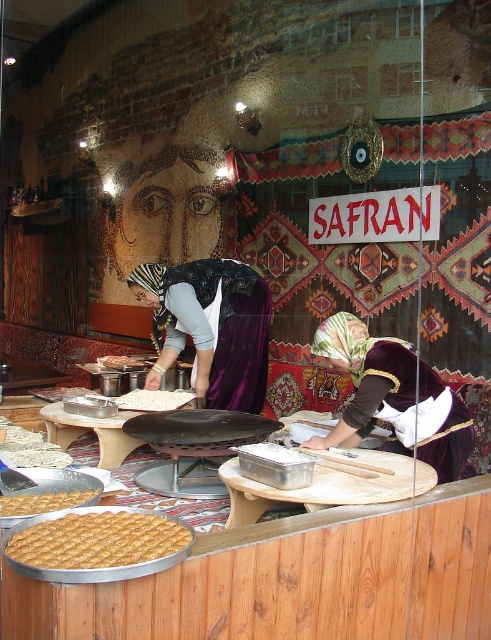
Is the position of velvet fabric headscarf at center more distant than that of white matte rice at center?

No, it is in front of white matte rice at center.

Is point (223, 291) closer to camera compared to point (129, 406)?

No.

This screenshot has height=640, width=491. I want to click on velvet fabric headscarf at center, so click(211, 326).

Can you confirm if velvet fabric headscarf at center is shorter than white flour at center?

No, velvet fabric headscarf at center is not shorter than white flour at center.

Who is taller, velvet fabric headscarf at center or white flour at center?

Standing taller between the two is velvet fabric headscarf at center.

Describe the element at coordinates (211, 326) in the screenshot. I see `velvet fabric headscarf at center` at that location.

At what (x,y) coordinates should I click in order to perform the action: click on velvet fabric headscarf at center. Please return your answer as a coordinate pair (x, y). This screenshot has width=491, height=640. Looking at the image, I should click on (211, 326).

Who is higher up, golden crispy pastry at center or golden crispy pastry at lower left?

golden crispy pastry at lower left

What do you see at coordinates (98, 540) in the screenshot? I see `golden crispy pastry at center` at bounding box center [98, 540].

You are a GUI agent. You are given a task and a screenshot of the screen. Output one action in this format:
    pyautogui.click(x=<x>, y=<y>)
    Task: Click on the golden crispy pastry at center
    Image resolution: width=491 pixels, height=640 pixels.
    Given the screenshot: What is the action you would take?
    pyautogui.click(x=98, y=540)